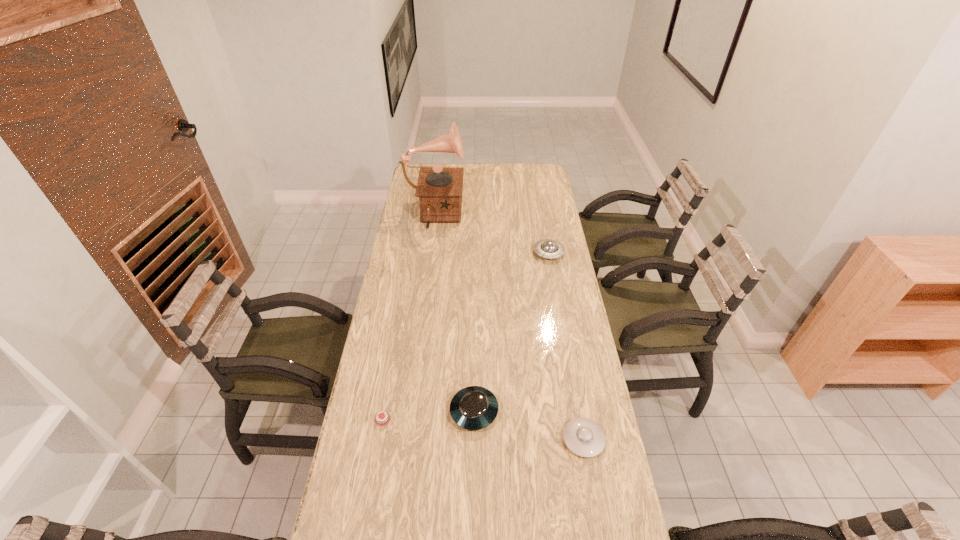
What are the coordinates of `free space between the farthest saucer and the shortest object` in the screenshot? It's located at (466, 336).

This screenshot has height=540, width=960. I want to click on free spot between the leftmost saucer and the farthest object, so click(x=454, y=314).

Image resolution: width=960 pixels, height=540 pixels. Find the location of `empty location between the leftmost saucer and the second farthest object`. empty location between the leftmost saucer and the second farthest object is located at coordinates (512, 332).

Identify the location of blank region between the leftmost saucer and the fourth tallest object. The image size is (960, 540). (529, 425).

Locate an element on the screen. The height and width of the screenshot is (540, 960). vacant area between the fourth nearest object and the shortest saucer is located at coordinates (566, 346).

Identify the location of vacant space that's between the record player and the farthest saucer. (492, 235).

Find the location of a particular element. This screenshot has width=960, height=540. blank region between the leftmost saucer and the fourth tallest object is located at coordinates tap(529, 425).

Select which object appears as the closest to the farthest object. Please provide its 2D coordinates. Your answer should be formatted as a tuple, i.e. [(x, y)], where the tuple contains the x and y coordinates of a point satisfying the conditions above.

[(547, 248)]

Point out which object is positioned as the fourth nearest to the shortest object. Please provide its 2D coordinates. Your answer should be formatted as a tuple, i.e. [(x, y)], where the tuple contains the x and y coordinates of a point satisfying the conditions above.

[(439, 189)]

Select which saucer appears as the closest to the fourth nearest object. Please provide its 2D coordinates. Your answer should be formatted as a tuple, i.e. [(x, y)], where the tuple contains the x and y coordinates of a point satisfying the conditions above.

[(473, 408)]